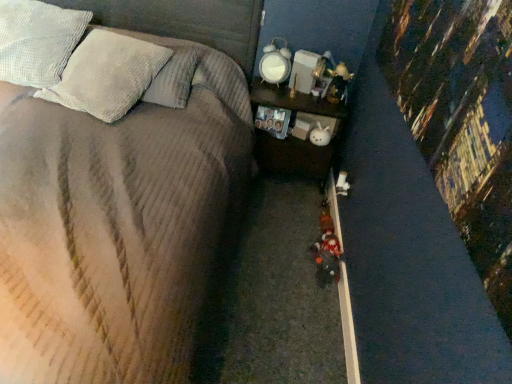
What do you see at coordinates (123, 207) in the screenshot?
I see `corduroy fabric bed at center` at bounding box center [123, 207].

Locate an element on the screen. Image resolution: width=512 pixels, height=384 pixels. smooth concrete curb at lower right is located at coordinates (348, 327).

What do you see at coordinates (106, 75) in the screenshot? I see `white textured pillow at upper left, acting as the 1th pillow starting from the right` at bounding box center [106, 75].

Locate an element on the screen. The image size is (512, 384). corduroy fabric bed at center is located at coordinates (123, 207).

Is smooth concrete curb at lower right thinner than white textured pillow at upper left, which is counted as the first pillow, starting from the left?

Yes, smooth concrete curb at lower right is thinner than white textured pillow at upper left, which is counted as the first pillow, starting from the left.

From the image's perspective, would you say smooth concrete curb at lower right is shown under white textured pillow at upper left, positioned as the 2th pillow in right-to-left order?

Yes.

Does smooth concrete curb at lower right touch white textured pillow at upper left, which is counted as the first pillow, starting from the left?

No, smooth concrete curb at lower right is not touching white textured pillow at upper left, which is counted as the first pillow, starting from the left.

From a real-world perspective, does smooth concrete curb at lower right sit lower than white textured pillow at upper left, positioned as the 2th pillow in right-to-left order?

Correct, in the physical world, smooth concrete curb at lower right is lower than white textured pillow at upper left, positioned as the 2th pillow in right-to-left order.

Is white textured pillow at upper left, positioned as the 2th pillow in right-to-left order, taller than wooden nightstand at center?

No, white textured pillow at upper left, positioned as the 2th pillow in right-to-left order, is not taller than wooden nightstand at center.

From the image's perspective, is white textured pillow at upper left, which is counted as the first pillow, starting from the left, located beneath wooden nightstand at center?

Incorrect, from the image's perspective, white textured pillow at upper left, which is counted as the first pillow, starting from the left, is higher than wooden nightstand at center.

Is the surface of white textured pillow at upper left, positioned as the 2th pillow in right-to-left order, in direct contact with wooden nightstand at center?

There is a gap between white textured pillow at upper left, positioned as the 2th pillow in right-to-left order, and wooden nightstand at center.

Image resolution: width=512 pixels, height=384 pixels. Find the location of `pillow that is the 1st object located in front of the wooden nightstand at center`. pillow that is the 1st object located in front of the wooden nightstand at center is located at coordinates (38, 41).

How distant is wooden nightstand at center from white textured pillow at upper left, which is counted as the first pillow, starting from the left?

wooden nightstand at center and white textured pillow at upper left, which is counted as the first pillow, starting from the left, are 1.17 meters apart from each other.

Would you consider wooden nightstand at center to be distant from white textured pillow at upper left, which is counted as the first pillow, starting from the left?

wooden nightstand at center is positioned a significant distance from white textured pillow at upper left, which is counted as the first pillow, starting from the left.

Can you confirm if wooden nightstand at center is wider than white textured pillow at upper left, which is counted as the first pillow, starting from the left?

In fact, wooden nightstand at center might be narrower than white textured pillow at upper left, which is counted as the first pillow, starting from the left.

From a real-world perspective, is wooden nightstand at center positioned over white textured pillow at upper left, which is counted as the first pillow, starting from the left, based on gravity?

No, from a real-world perspective, wooden nightstand at center is not on top of white textured pillow at upper left, which is counted as the first pillow, starting from the left.

Would you say white textured pillow at upper left, positioned as the 2th pillow in right-to-left order, is inside or outside plush fabric toy at center?

white textured pillow at upper left, positioned as the 2th pillow in right-to-left order, is outside plush fabric toy at center.

Is plush fabric toy at center at the back of white textured pillow at upper left, which is counted as the first pillow, starting from the left?

No, white textured pillow at upper left, which is counted as the first pillow, starting from the left,'s orientation is not away from plush fabric toy at center.

Is white textured pillow at upper left, positioned as the 2th pillow in right-to-left order, bigger than corduroy fabric bed at center?

Actually, white textured pillow at upper left, positioned as the 2th pillow in right-to-left order, might be smaller than corduroy fabric bed at center.

Would you say white textured pillow at upper left, which is counted as the first pillow, starting from the left, is inside or outside corduroy fabric bed at center?

white textured pillow at upper left, which is counted as the first pillow, starting from the left, lies within the bounds of corduroy fabric bed at center.

Could you tell me if white textured pillow at upper left, positioned as the 2th pillow in right-to-left order, is facing corduroy fabric bed at center?

Yes, white textured pillow at upper left, positioned as the 2th pillow in right-to-left order, is facing corduroy fabric bed at center.

How far apart are white textured pillow at upper left, positioned as the 2th pillow in right-to-left order, and corduroy fabric bed at center?

The distance of white textured pillow at upper left, positioned as the 2th pillow in right-to-left order, from corduroy fabric bed at center is 18.58 inches.

From a real-world perspective, is wooden nightstand at center over plush fabric toy at center?

Yes, from a real-world perspective, wooden nightstand at center is on top of plush fabric toy at center.

Consider the image. Is the position of wooden nightstand at center more distant than that of plush fabric toy at center?

Yes, wooden nightstand at center is further from the viewer.

Based on their positions, is wooden nightstand at center located to the left or right of plush fabric toy at center?

Based on their positions, wooden nightstand at center is located to the left of plush fabric toy at center.

Does wooden nightstand at center have a larger size compared to plush fabric toy at center?

Yes.

From a real-world perspective, which object rests below the other?

corduroy fabric bed at center, from a real-world perspective.

Is corduroy fabric bed at center not inside white textured pillow at upper left, which is counted as the first pillow, starting from the left?

Yes, corduroy fabric bed at center is not within white textured pillow at upper left, which is counted as the first pillow, starting from the left.

Consider the image. From the image's perspective, who appears lower, corduroy fabric bed at center or white textured pillow at upper left, which is counted as the first pillow, starting from the left?

corduroy fabric bed at center.

Considering the sizes of corduroy fabric bed at center and white textured pillow at upper left, positioned as the 2th pillow in right-to-left order, in the image, is corduroy fabric bed at center taller or shorter than white textured pillow at upper left, positioned as the 2th pillow in right-to-left order,?

A: Considering their sizes, corduroy fabric bed at center has more height than white textured pillow at upper left, positioned as the 2th pillow in right-to-left order.

At what (x,y) coordinates should I click in order to perform the action: click on the 2nd pillow counting from the left of the smooth concrete curb at lower right. Please return your answer as a coordinate pair (x, y). Image resolution: width=512 pixels, height=384 pixels. Looking at the image, I should click on (38, 41).

Where is `nightstand to the right of white textured pillow at upper left, positioned as the 2th pillow in right-to-left order`? The image size is (512, 384). nightstand to the right of white textured pillow at upper left, positioned as the 2th pillow in right-to-left order is located at coordinates (294, 137).

Which object lies further to the anchor point smooth concrete curb at lower right, wooden nightstand at center or corduroy fabric bed at center?

The object further to smooth concrete curb at lower right is corduroy fabric bed at center.

Estimate the real-world distances between objects in this image. Which object is further from wooden nightstand at center, corduroy fabric bed at center or white textured pillow at upper left, positioned as the 2th pillow in right-to-left order?

Based on the image, white textured pillow at upper left, positioned as the 2th pillow in right-to-left order, appears to be further to wooden nightstand at center.

From the image, which object appears to be nearer to corduroy fabric bed at center, smooth concrete curb at lower right or plush fabric toy at center?

smooth concrete curb at lower right is closer to corduroy fabric bed at center.

Looking at this image, from the image, which object appears to be farther from plush fabric toy at center, wooden nightstand at center or corduroy fabric bed at center?

The object further to plush fabric toy at center is corduroy fabric bed at center.

Which object lies further to the anchor point white textured pillow at upper left, positioned as the 2th pillow in right-to-left order, corduroy fabric bed at center or plush fabric toy at center?

Among the two, plush fabric toy at center is located further to white textured pillow at upper left, positioned as the 2th pillow in right-to-left order.

Based on their spatial positions, is smooth concrete curb at lower right or white textured pillow at upper left, acting as the 1th pillow starting from the right, closer to corduroy fabric bed at center?

white textured pillow at upper left, acting as the 1th pillow starting from the right, is positioned closer to the anchor corduroy fabric bed at center.

Based on their spatial positions, is smooth concrete curb at lower right or corduroy fabric bed at center closer to white textured pillow at upper left, which is counted as the first pillow, starting from the left?

Based on the image, corduroy fabric bed at center appears to be nearer to white textured pillow at upper left, which is counted as the first pillow, starting from the left.

Based on the photo, from the image, which object appears to be farther from smooth concrete curb at lower right, plush fabric toy at center or white textured pillow at upper left, positioned as the 2th pillow in right-to-left order?

white textured pillow at upper left, positioned as the 2th pillow in right-to-left order, is positioned further to the anchor smooth concrete curb at lower right.

Image resolution: width=512 pixels, height=384 pixels. I want to click on nightstand between white textured pillow at upper left, which is counted as the first pillow, starting from the left, and smooth concrete curb at lower right, in the horizontal direction, so click(294, 137).

The image size is (512, 384). What are the coordinates of `toy between white textured pillow at upper left, positioned as the 2th pillow in right-to-left order, and smooth concrete curb at lower right, in the horizontal direction` in the screenshot? It's located at pyautogui.click(x=327, y=256).

Locate an element on the screen. The image size is (512, 384). pillow located between corduroy fabric bed at center and white textured pillow at upper left, which is counted as the first pillow, starting from the left, in the depth direction is located at coordinates (106, 75).

Find the location of `toy between smooth concrete curb at lower right and wooden nightstand at center from front to back`. toy between smooth concrete curb at lower right and wooden nightstand at center from front to back is located at coordinates (327, 256).